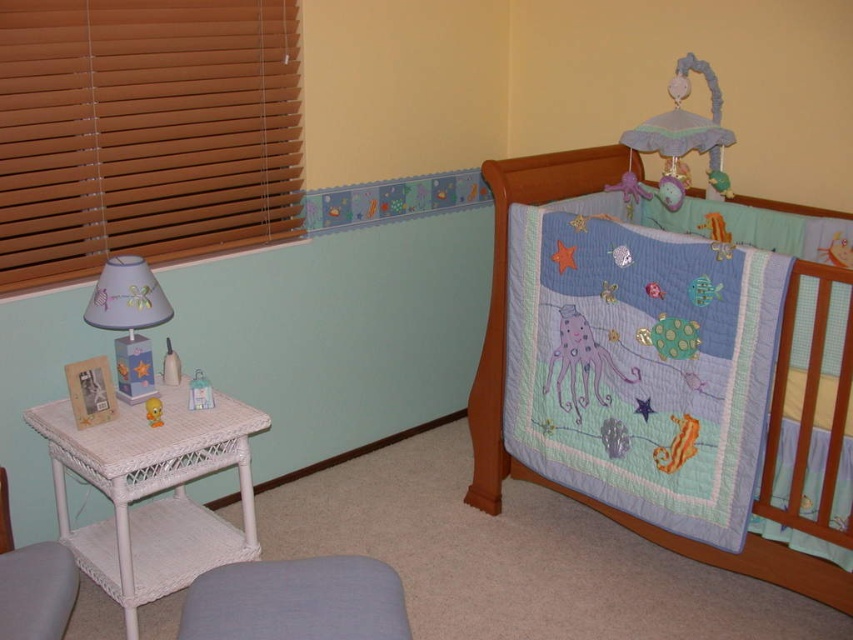
Which of these two, wooden blinds at left or white wicker table at lower left, stands shorter?

Standing shorter between the two is white wicker table at lower left.

Does wooden blinds at left appear under white wicker table at lower left?

Incorrect, wooden blinds at left is not positioned below white wicker table at lower left.

Is point (196, 170) in front of point (154, 570)?

No, it is behind (154, 570).

Where is `wooden blinds at left`? Image resolution: width=853 pixels, height=640 pixels. wooden blinds at left is located at coordinates (144, 131).

Is embroidered cotton crib quilt at upper right smaller than white wicker table at lower left?

Incorrect, embroidered cotton crib quilt at upper right is not smaller in size than white wicker table at lower left.

Does embroidered cotton crib quilt at upper right have a lesser width compared to white wicker table at lower left?

No.

Describe the element at coordinates (503, 387) in the screenshot. I see `embroidered cotton crib quilt at upper right` at that location.

Locate an element on the screen. Image resolution: width=853 pixels, height=640 pixels. embroidered cotton crib quilt at upper right is located at coordinates (503, 387).

Is point (15, 586) farther from viewer compared to point (157, 416)?

No.

Which is behind, point (7, 515) or point (146, 400)?

The point (146, 400) is more distant.

This screenshot has height=640, width=853. I want to click on white wicker chair at lower left, so click(33, 582).